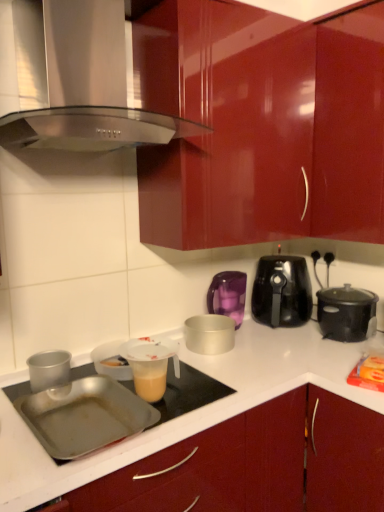
Locate an element on the screen. This screenshot has height=512, width=384. blank space above glossy wood cabinet at center (from a real-world perspective) is located at coordinates (235, 371).